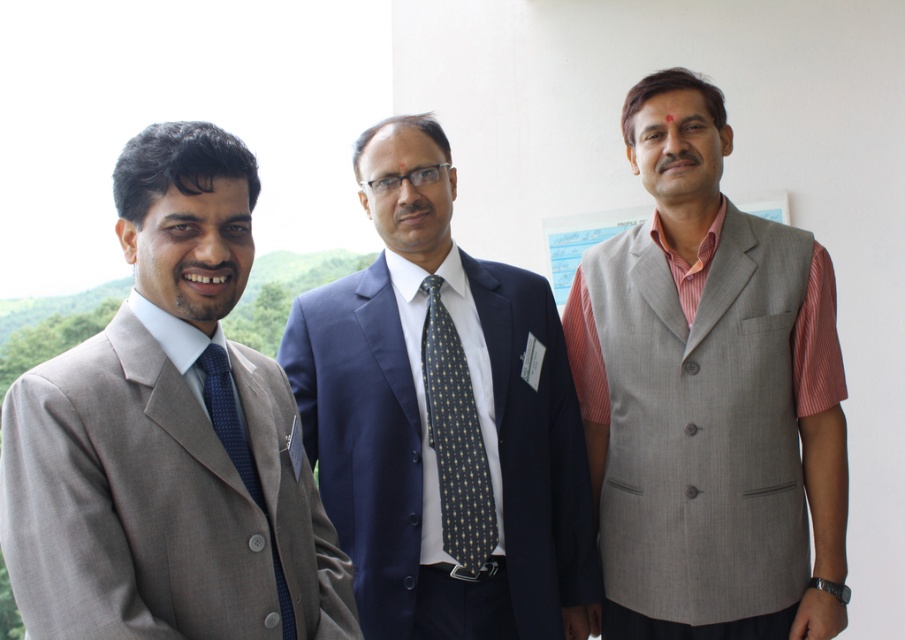
You are a photographer setting up for a group portrait. You notice the matte gray suit at left and the blue paper at center in the scene. Based on their positions, which object would require you to adjust your camera angle downward to include it in the frame?

The matte gray suit at left is located below the blue paper at center, so you would need to adjust your camera angle downward to include the matte gray suit at left in the frame.

Based on the scene description, where is the light gray woolen vest at right located in terms of its 2D coordinates?

The light gray woolen vest at right is located at the 2D coordinates of point (710, 397).

Looking at the scene, where is the matte gray suit at left positioned relative to the blue paper at center?

The matte gray suit at left is to the left of the blue paper at center.